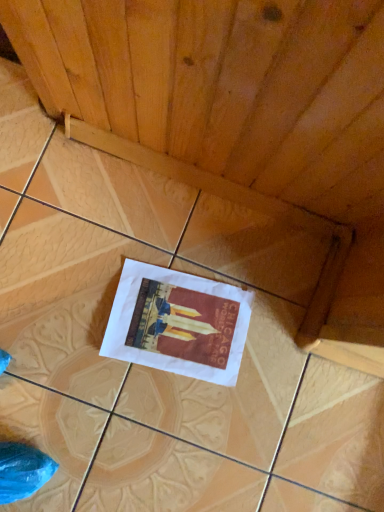
Identify the location of free spot to the left of white paper poster at center. The width and height of the screenshot is (384, 512). (85, 265).